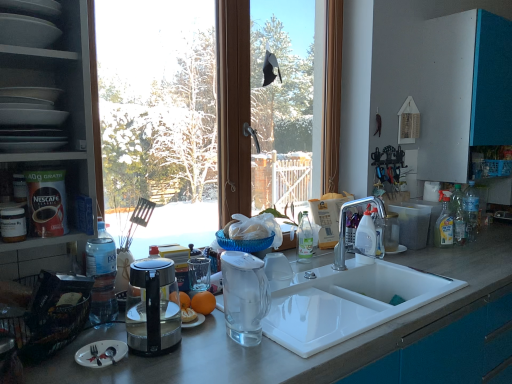
Where is `vacant space in between white plastic bottle at sink right, which is counted as the 1th bottle, starting from the left, and transparent glass blender at sink`? The height and width of the screenshot is (384, 512). vacant space in between white plastic bottle at sink right, which is counted as the 1th bottle, starting from the left, and transparent glass blender at sink is located at coordinates (303, 304).